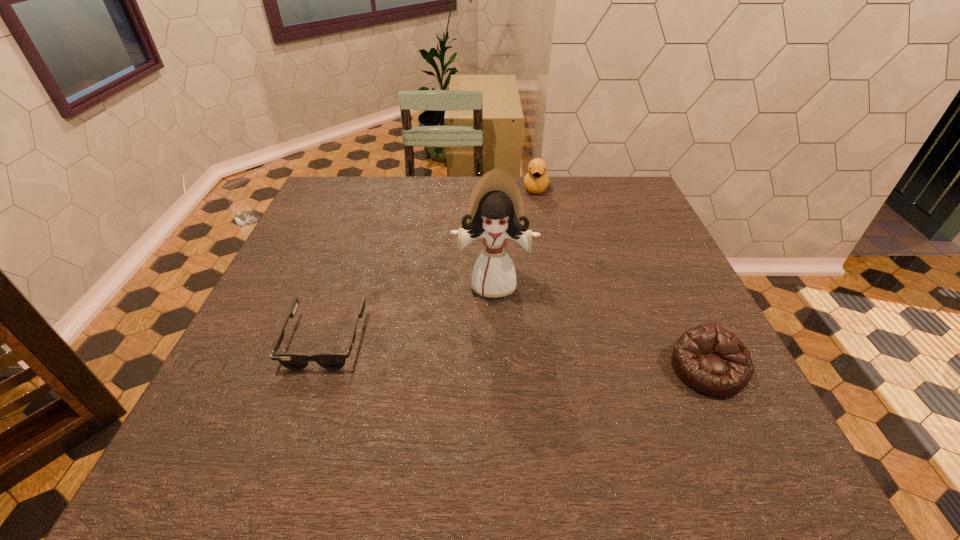
The width and height of the screenshot is (960, 540). Find the location of `free space on the desktop that is between the leftmost object and the second shortest object and is positioned facing forward on the third object from left to right`. free space on the desktop that is between the leftmost object and the second shortest object and is positioned facing forward on the third object from left to right is located at coordinates (521, 355).

This screenshot has width=960, height=540. I want to click on vacant space on the desktop that is between the sunglasses and the beanbag and is positioned at the front face of the doll, so click(491, 353).